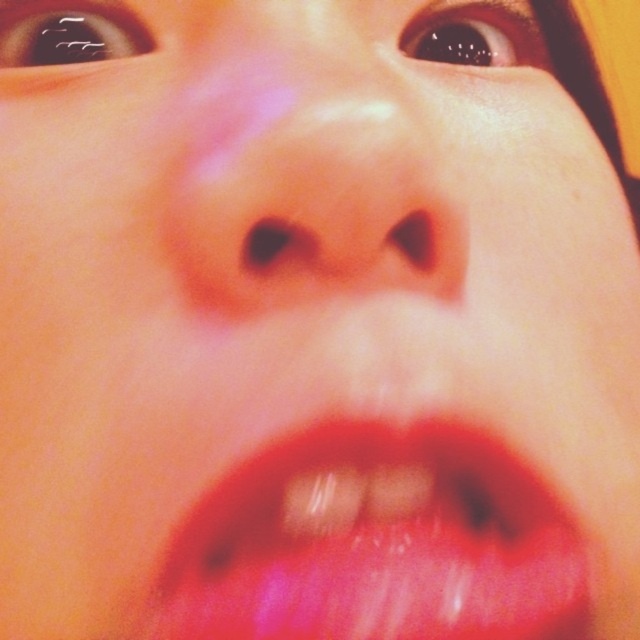
Consider the image. You are a makeup artist trying to apply lipstick. You have the shiny red lips at lower center and the smooth skin nose at center in your view. Which object is located to the right of the other?

The shiny red lips at lower center is positioned on the right side of smooth skin nose at center.

Based on the photo, you are a photographer adjusting your camera to focus on the shiny red lips at lower center and the smooth skin nose at center. Which object should you focus on first if you want to ensure the closest object is sharp?

The shiny red lips at lower center should be focused on first because it is closer to the viewer than the smooth skin nose at center, ensuring the closest object is sharp.

Consider the image. You are an artist trying to paint the lips in the image. The point at coordinates point (376,544) is crucial for shading. Where exactly on the lips should you place this point?

The point (376,544) is on the shiny red lips at lower center, so you should place it there for accurate shading.